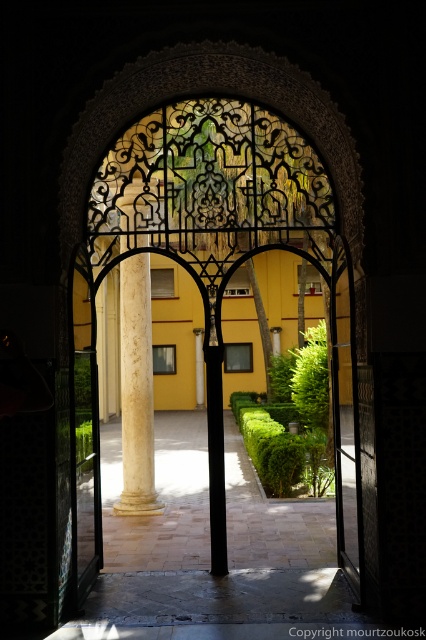
Does white marble column at center appear on the right side of black metal gate at center?

No, white marble column at center is not to the right of black metal gate at center.

Who is lower down, white marble column at center or black metal gate at center?

white marble column at center is lower down.

The width and height of the screenshot is (426, 640). I want to click on white marble column at center, so click(x=137, y=390).

You are a GUI agent. You are given a task and a screenshot of the screen. Output one action in this format:
    pyautogui.click(x=<x>, y=<y>)
    Task: Click on the white marble column at center
    The image size is (426, 640).
    Given the screenshot: What is the action you would take?
    pyautogui.click(x=137, y=390)

Can you confirm if paved stone path at center is positioned to the left of white marble column at center?

In fact, paved stone path at center is to the right of white marble column at center.

Is point (150, 568) more distant than point (126, 476)?

No, it is not.

The image size is (426, 640). Identify the location of paved stone path at center. (161, 499).

Between paved stone path at center and black metal gate at center, which one appears on the right side from the viewer's perspective?

black metal gate at center is more to the right.

Does point (307, 554) come farther from viewer compared to point (351, 426)?

That is True.

Locate an element on the screen. The width and height of the screenshot is (426, 640). paved stone path at center is located at coordinates (161, 499).

Find the location of a particular element. The width and height of the screenshot is (426, 640). paved stone path at center is located at coordinates (161, 499).